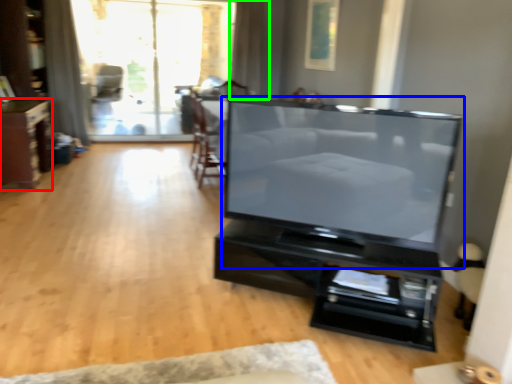
Question: Which object is positioned farthest from furniture (highlighted by a red box)? Select from television (highlighted by a blue box) and curtain (highlighted by a green box).

Choices:
 (A) television
 (B) curtain

Answer: (A)